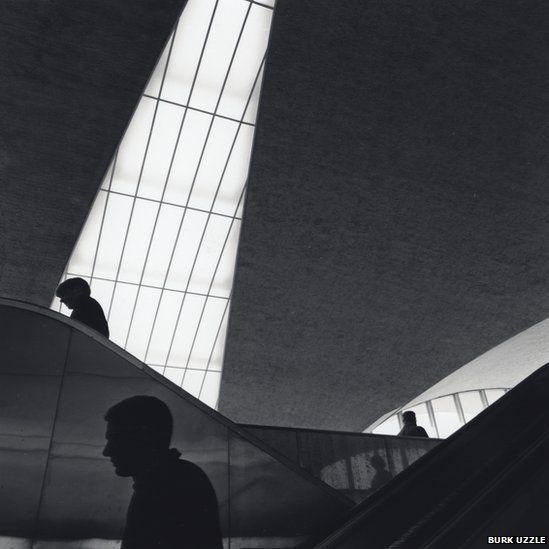
Identify the location of hand rail. This screenshot has height=549, width=549. (480, 498).